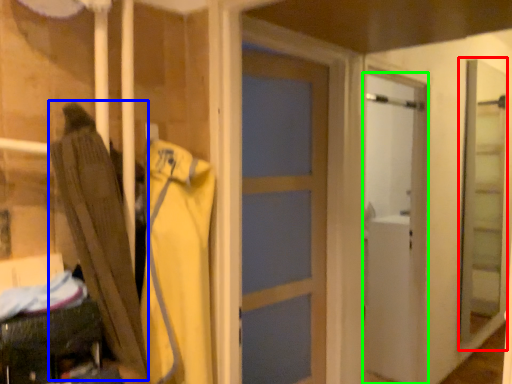
Question: Based on their relative distances, which object is nearer to screen door (highlighted by a red box)? Choose from umbrella (highlighted by a blue box) and door (highlighted by a green box).

Choices:
 (A) umbrella
 (B) door

Answer: (B)